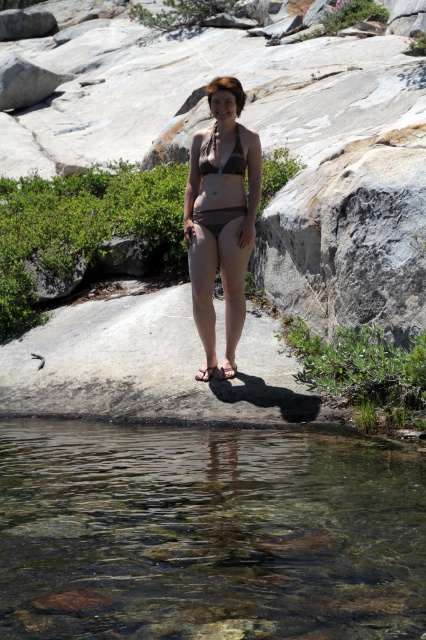
Question: Which object is the farthest from the matte black bikini at center?

Choices:
 (A) brown matte bikini at center
 (B) gray rock at center
 (C) clear glassy water at lower center
 (D) matte brown bikini top at center

Answer: (B)

Question: Is matte black bikini at center positioned behind matte brown bikini top at center?

Choices:
 (A) yes
 (B) no

Answer: (A)

Question: Which of the following is the farthest from the observer?

Choices:
 (A) (118, 611)
 (B) (215, 209)
 (C) (216, 252)

Answer: (C)

Question: Is gray rock at center to the right of matte brown bikini top at center from the viewer's perspective?

Choices:
 (A) no
 (B) yes

Answer: (A)

Question: Which point is farther to the camera?

Choices:
 (A) (336, 81)
 (B) (201, 172)

Answer: (A)

Question: Is clear glassy water at lower center thinner than matte brown bikini top at center?

Choices:
 (A) no
 (B) yes

Answer: (A)